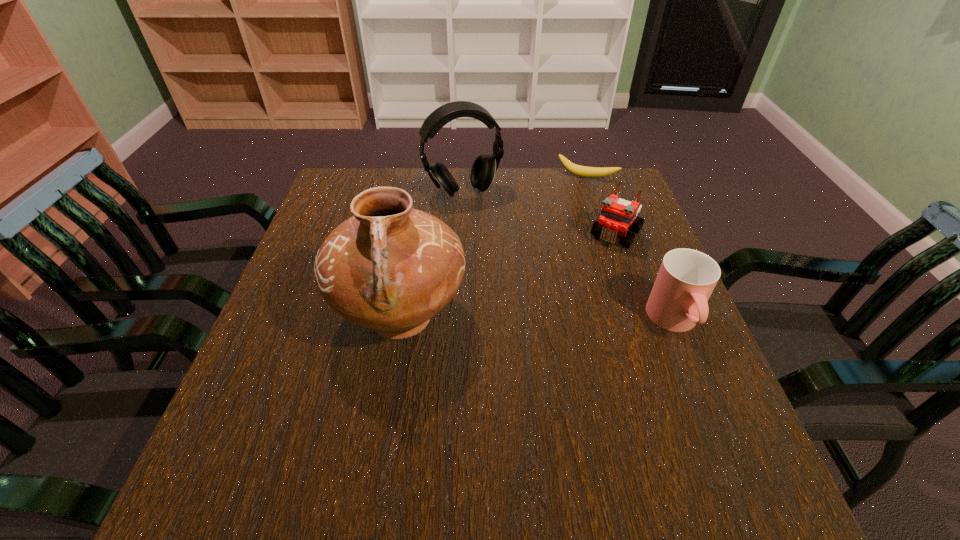
This screenshot has width=960, height=540. Identify the location of Lego that is positioned at the right edge. (617, 215).

This screenshot has height=540, width=960. In order to click on banana that is at the right edge in this screenshot , I will do `click(583, 171)`.

This screenshot has height=540, width=960. Find the location of `object present at the far right corner`. object present at the far right corner is located at coordinates point(583,171).

Where is `vacant area at the far edge of the desktop`? The height and width of the screenshot is (540, 960). vacant area at the far edge of the desktop is located at coordinates (456, 176).

The image size is (960, 540). In the image, there is a desktop. What are the coordinates of `vacant space at the near edge` in the screenshot? It's located at (430, 439).

Image resolution: width=960 pixels, height=540 pixels. In the image, there is a desktop. Find the location of `free space at the left edge`. free space at the left edge is located at coordinates (318, 293).

Where is `free space at the right edge of the desktop`? Image resolution: width=960 pixels, height=540 pixels. free space at the right edge of the desktop is located at coordinates (691, 343).

Where is `free space at the far left corner of the desktop`? Image resolution: width=960 pixels, height=540 pixels. free space at the far left corner of the desktop is located at coordinates (340, 170).

Find the location of a particular element. The image size is (960, 540). vacant space that is in between the banana and the pottery is located at coordinates (493, 247).

The height and width of the screenshot is (540, 960). Identify the location of blank region between the third farthest object and the cup. (645, 278).